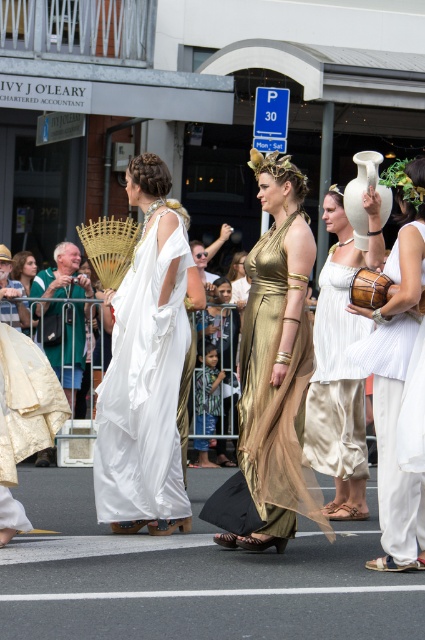
In the parade scene, you see the white matte vase at right and the white silk toga at lower left. Which object is placed higher in the image?

The white matte vase at right is positioned over the white silk toga at lower left, so it is higher.

You are a photographer standing at the back of the crowd. You want to take a photo of the gold metallic dress at center and the white matte vase at right so that both are in focus. The camera you are using has a depth of field that can cover 20 inches. Can you capture both subjects in focus without moving your position?

The distance between the gold metallic dress at center and the white matte vase at right is 21.92 inches. Since the camera can only cover 20 inches, it won not be possible to capture both subjects in focus without moving your position.